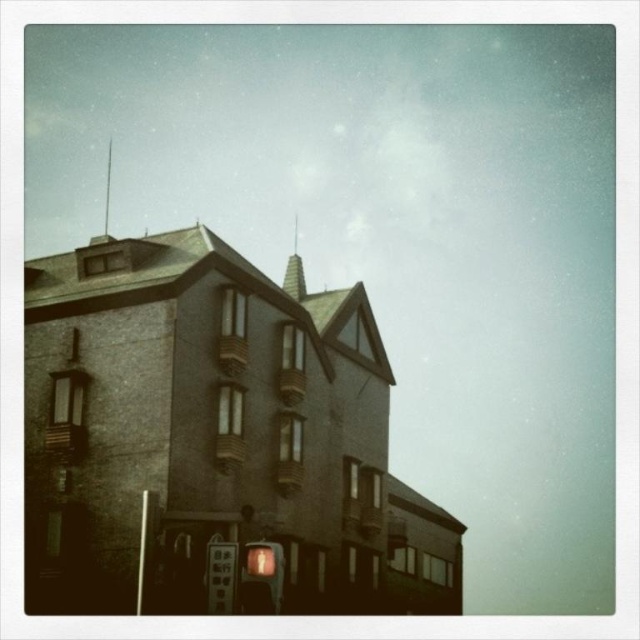
From the picture: Is matte orange traffic light at center positioned in front of metallic gray sign at lower center?

Yes, matte orange traffic light at center is in front of metallic gray sign at lower center.

Who is more forward, [243,576] or [221,547]?

Point [243,576] is more forward.

Find the location of `matte orange traffic light at center`. matte orange traffic light at center is located at coordinates (260, 577).